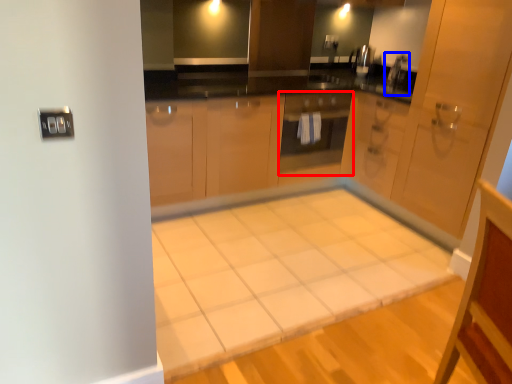
Question: Which of the following is the closest to the observer, oven (highlighted by a red box) or faucet (highlighted by a blue box)?

Choices:
 (A) oven
 (B) faucet

Answer: (A)